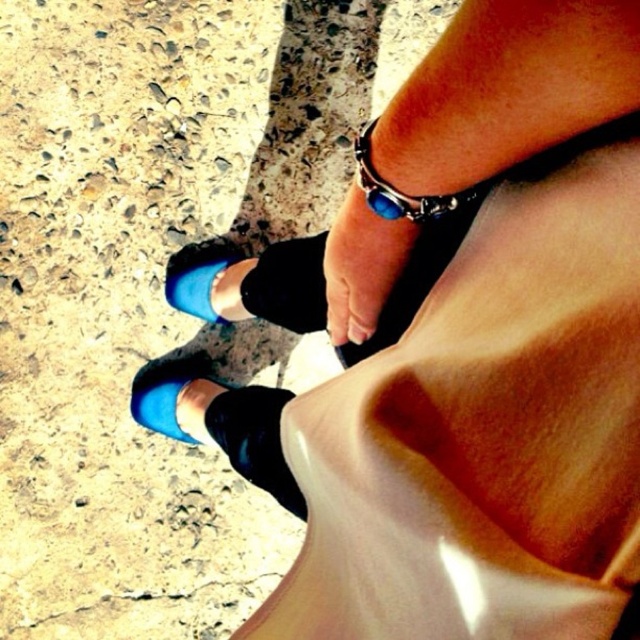
Is point (301, 502) farther from viewer compared to point (202, 298)?

That is False.

Measure the distance from black leather ankle at lower center to blue suede shoe at lower center.

12.62 inches

Does point (262, 464) come behind point (184, 275)?

No, (262, 464) is closer to viewer.

This screenshot has height=640, width=640. What are the coordinates of `black leather ankle at lower center` in the screenshot? It's located at (256, 440).

Does blue suede sandal at lower left lie behind blue stone bracelet at upper center?

Yes, blue suede sandal at lower left is behind blue stone bracelet at upper center.

Image resolution: width=640 pixels, height=640 pixels. What are the coordinates of `blue suede sandal at lower left` in the screenshot? It's located at (173, 396).

This screenshot has width=640, height=640. What do you see at coordinates (173, 396) in the screenshot?
I see `blue suede sandal at lower left` at bounding box center [173, 396].

Where is `blue suede sandal at lower left`? blue suede sandal at lower left is located at coordinates (173, 396).

Between point (243, 403) and point (368, 172), which one is positioned in front?

Point (368, 172) is more forward.

Who is taller, black leather ankle at lower center or blue stone bracelet at upper center?

black leather ankle at lower center

I want to click on black leather ankle at lower center, so click(x=256, y=440).